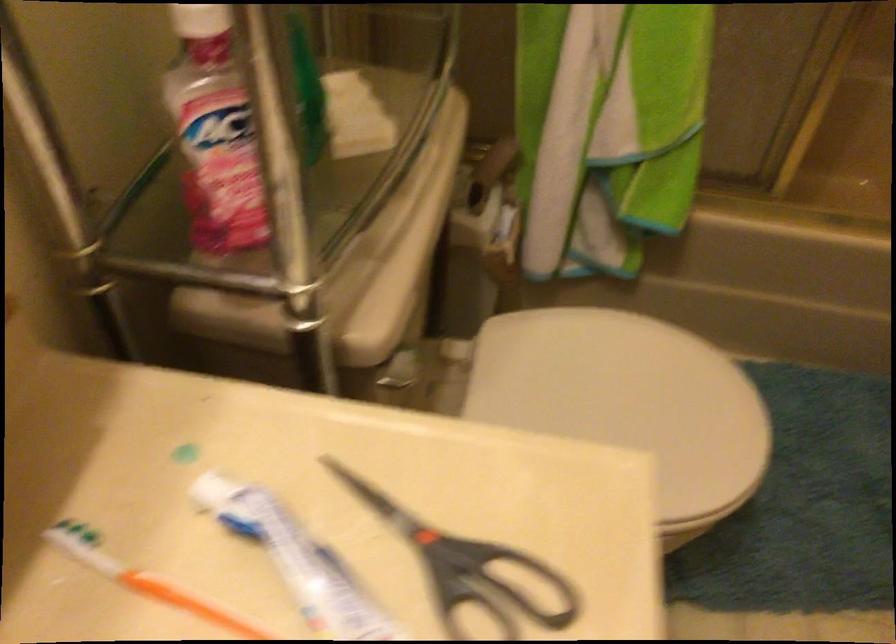
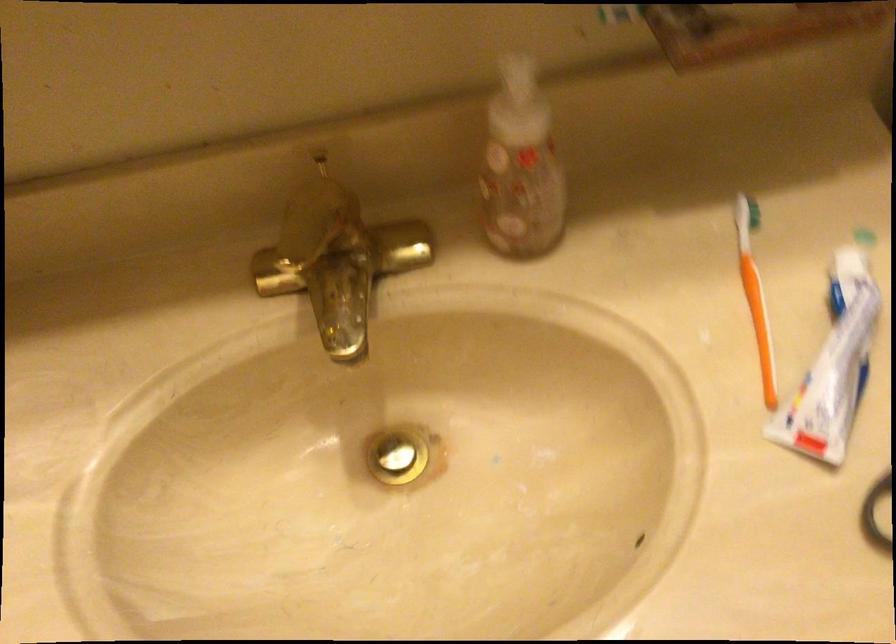
First-person continuous shooting, in which direction is the camera rotating?

The rotation direction of the camera is left-down.